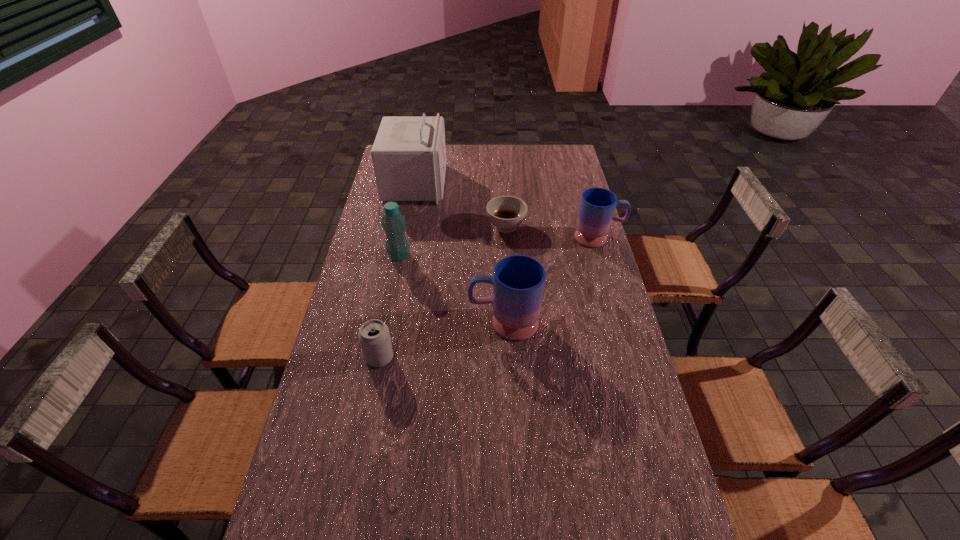
The mugs are evenly distributed in the image. To maintain this, where would you place another mug on the left? Please point to a free space. Please provide its 2D coordinates. Your answer should be formatted as a tuple, i.e. [(x, y)], where the tuple contains the x and y coordinates of a point satisfying the conditions above.

[(358, 453)]